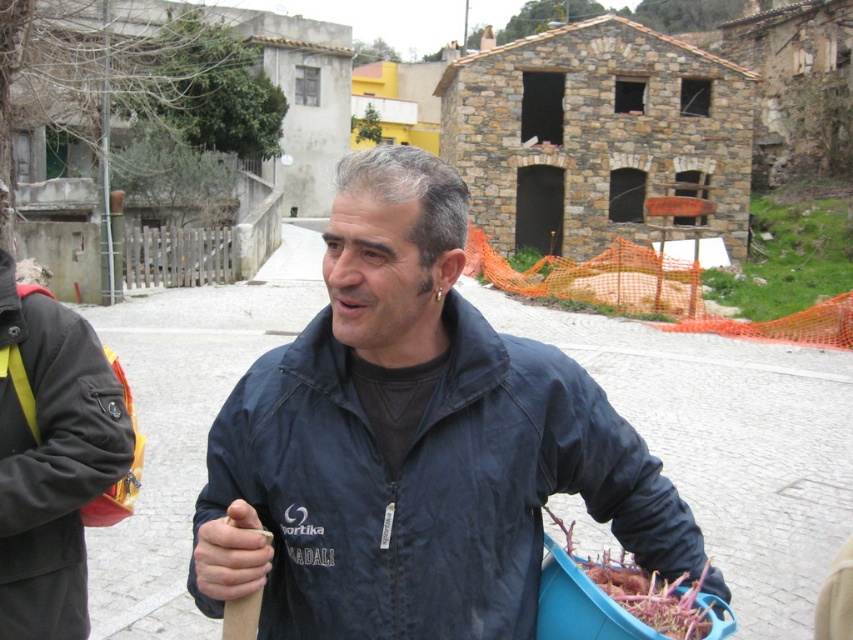
You are standing at the point marked by the coordinates point (412, 444) in the image. What object is directly in front of you?

The point (412, 444) marks the dark blue jacket at center, so the object directly in front of you is the dark blue jacket at center.

You are standing at the origin point of the image, which is the bottom left corner. The dark blue jacket at center is located at coordinate point 0.694, 0.484. If you walk straight towards the jacket, will you encounter any obstacles in your path?

The dark blue jacket at center is located at coordinate point (412,444). Since the jacket is in the foreground and the background has a cobblestone street leading towards buildings, there are no obstacles blocking the path directly towards the jacket. You can walk straight to it without any hindrance.